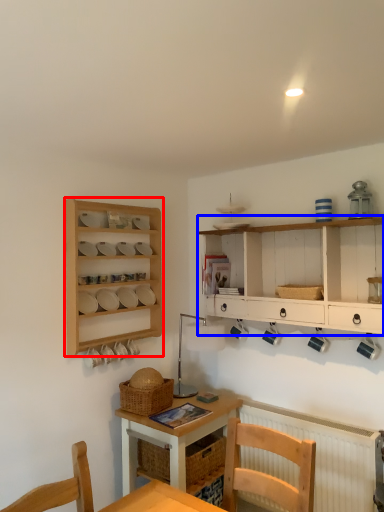
Question: Which of the following is the closest to the observer, shelf (highlighted by a red box) or cabinetry (highlighted by a blue box)?

Choices:
 (A) shelf
 (B) cabinetry

Answer: (B)